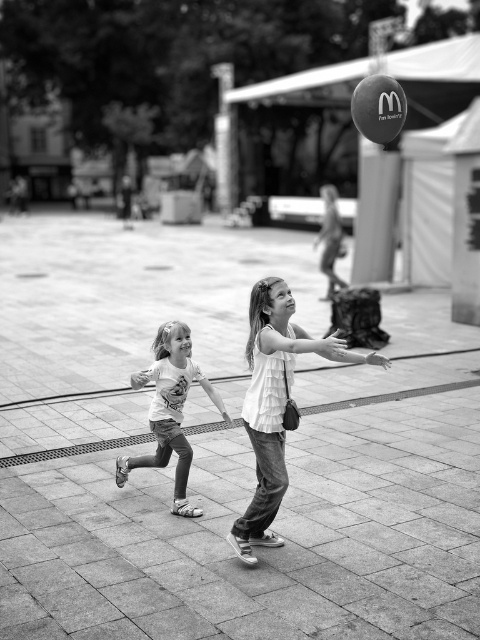
You are standing at the center of the plaza and see two points marked in the image. Which point is closer to you, point (274, 460) or point (152, 426)?

Point (274, 460) is in front of point (152, 426), so it is closer to you.